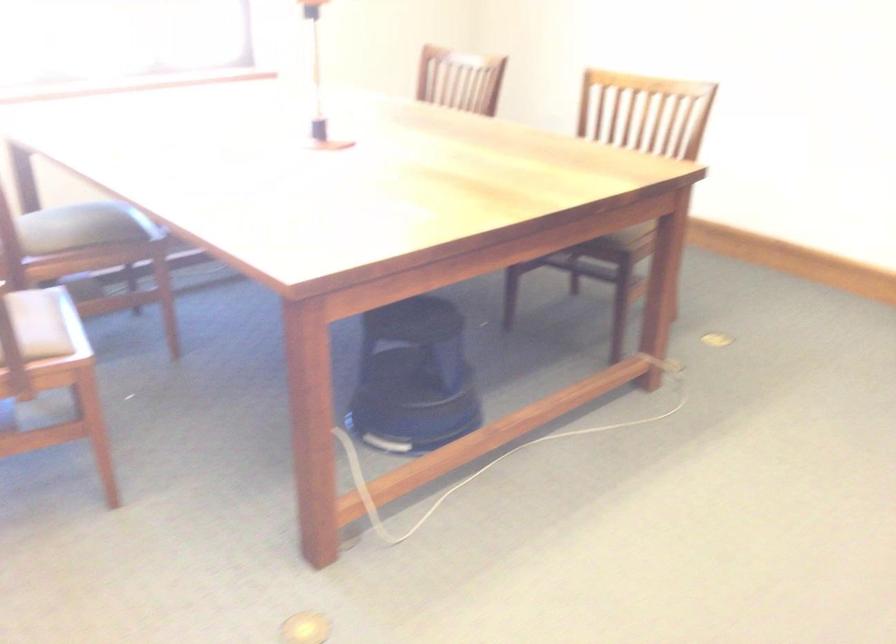
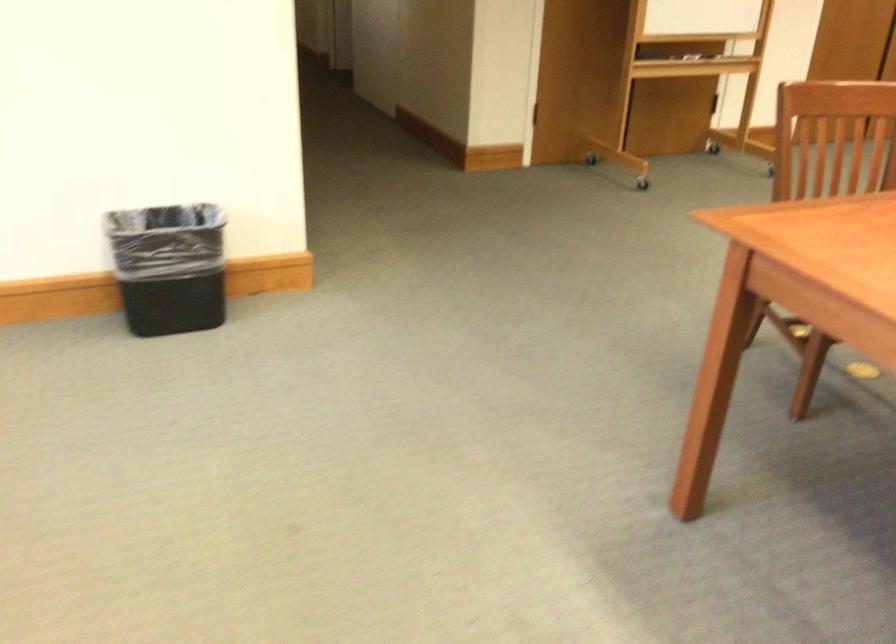
Question: The camera is either moving clockwise (left) or counter-clockwise (right) around the object. The first image is from the beginning of the video and the second image is from the end. Is the camera moving left or right when shooting the video?

Choices:
 (A) Left
 (B) Right

Answer: (A)